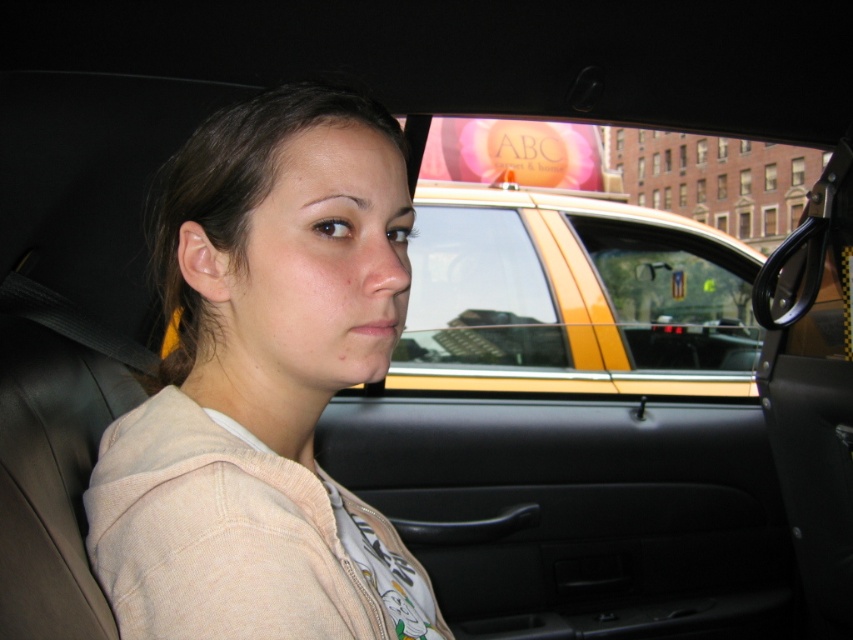
Question: Observing the image, what is the correct spatial positioning of light beige hoodie at center in reference to yellow plastic taxi at center?

Choices:
 (A) below
 (B) above

Answer: (A)

Question: Is light beige hoodie at center smaller than yellow plastic taxi at center?

Choices:
 (A) no
 (B) yes

Answer: (B)

Question: Does light beige hoodie at center come in front of yellow plastic taxi at center?

Choices:
 (A) yes
 (B) no

Answer: (A)

Question: Among these objects, which one is nearest to the camera?

Choices:
 (A) yellow plastic taxi at center
 (B) light beige hoodie at center

Answer: (B)